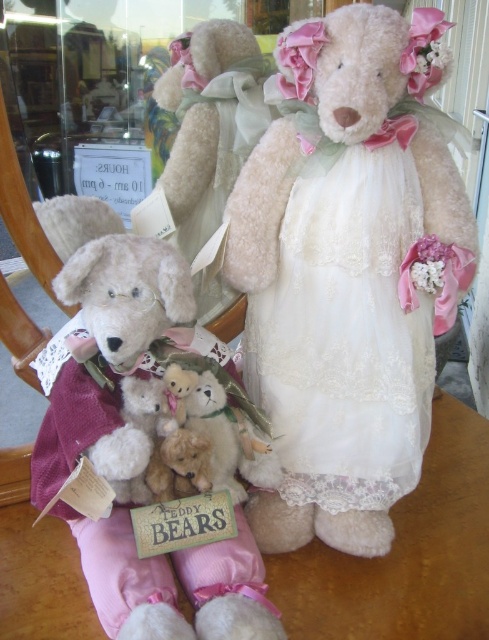
Is white lace dress at center closer to the viewer compared to fluffy white teddy bear at lower left?

That is False.

Where is `white lace dress at center`? white lace dress at center is located at coordinates (336, 323).

Image resolution: width=489 pixels, height=640 pixels. I want to click on white lace dress at center, so click(x=336, y=323).

Where is `white lace dress at center`? This screenshot has width=489, height=640. white lace dress at center is located at coordinates (336, 323).

Is fluffy white teddy bear at lower left above fluffy white teddy bear at center?

Actually, fluffy white teddy bear at lower left is below fluffy white teddy bear at center.

Does point (132, 532) come farther from viewer compared to point (183, 145)?

No, (132, 532) is in front of (183, 145).

This screenshot has height=640, width=489. In order to click on fluffy white teddy bear at lower left in this screenshot , I will do `click(137, 449)`.

Is fluffy white teddy bear at lower left above wooden table at center?

Correct, fluffy white teddy bear at lower left is located above wooden table at center.

Which is in front, point (50, 456) or point (45, 588)?

Point (45, 588)

Where is `fluffy white teddy bear at lower left`? The height and width of the screenshot is (640, 489). fluffy white teddy bear at lower left is located at coordinates (137, 449).